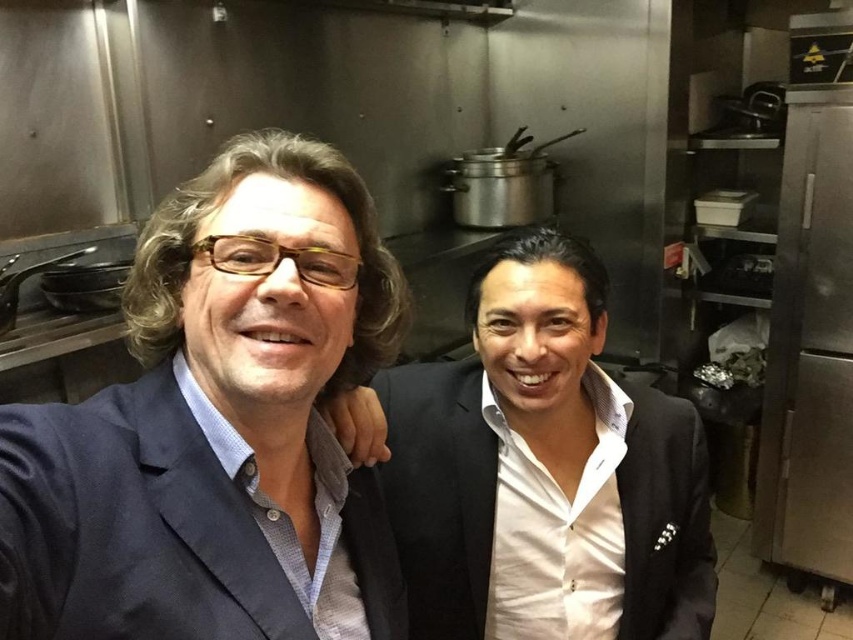
Does point (218, 369) come closer to viewer compared to point (473, 518)?

Yes, it is in front of point (473, 518).

The height and width of the screenshot is (640, 853). What do you see at coordinates (219, 426) in the screenshot?
I see `matte black suit at left` at bounding box center [219, 426].

Who is more forward, [310,276] or [686,481]?

Point [310,276] is in front.

The image size is (853, 640). I want to click on matte black suit at left, so click(x=219, y=426).